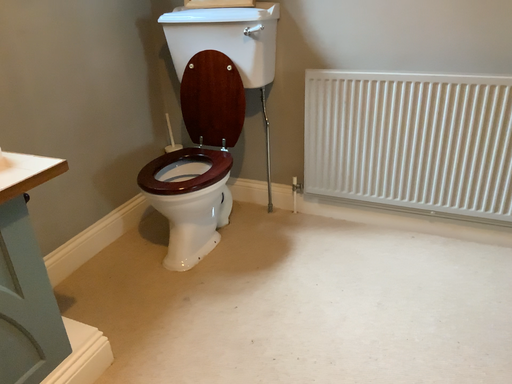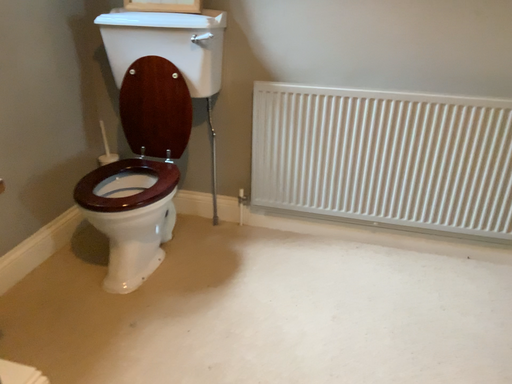
Question: How did the camera likely rotate when shooting the video?

Choices:
 (A) rotated right
 (B) rotated left

Answer: (A)